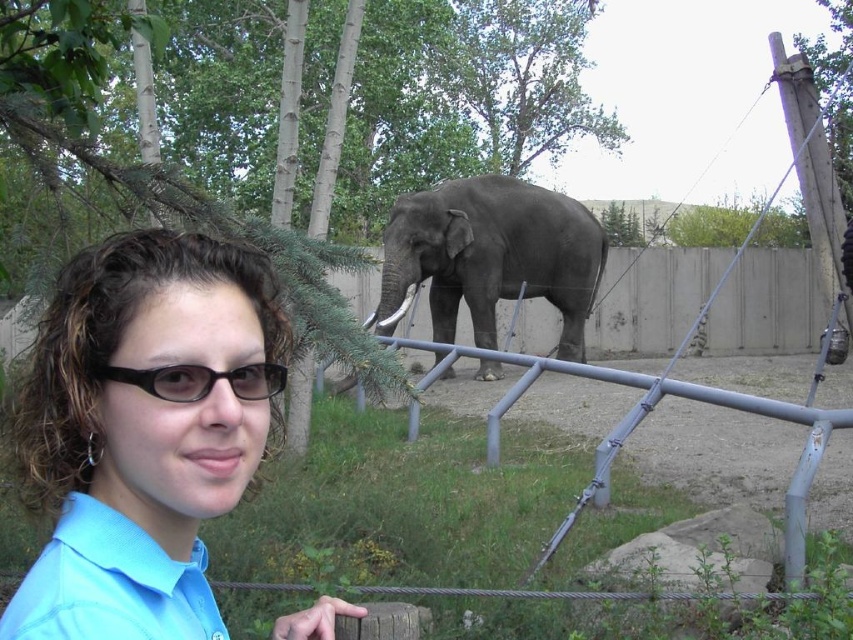
You are a photographer trying to capture a closeup of the elephant. You notice the light blue fabric shirt at lower left and the black plastic glasses at center in your frame. Which object should you move closer to the right side to avoid them in your shot?

To avoid the light blue fabric shirt at lower left and black plastic glasses at center in your shot, you should move the light blue fabric shirt at lower left to the right since it is currently to the left of the black plastic glasses at center.